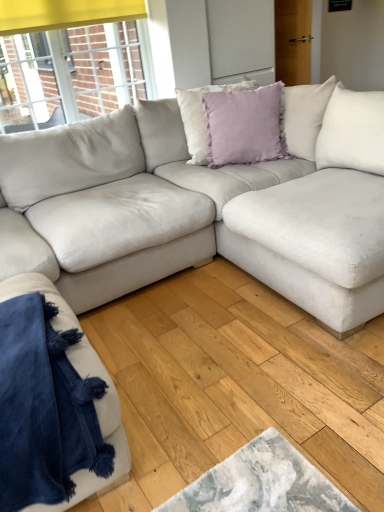
Question: Is lavender velvet pillow at center, marked as the second pillow in a front-to-back arrangement, bigger than velvet blue blanket at lower left?

Choices:
 (A) yes
 (B) no

Answer: (B)

Question: Can you confirm if lavender velvet pillow at center, the first pillow positioned from the back, is taller than velvet blue blanket at lower left?

Choices:
 (A) yes
 (B) no

Answer: (A)

Question: From the image's perspective, is lavender velvet pillow at center, the first pillow positioned from the back, under velvet blue blanket at lower left?

Choices:
 (A) no
 (B) yes

Answer: (A)

Question: Is the position of lavender velvet pillow at center, the first pillow positioned from the back, less distant than that of velvet blue blanket at lower left?

Choices:
 (A) no
 (B) yes

Answer: (A)

Question: Is lavender velvet pillow at center, the first pillow positioned from the back, smaller than velvet blue blanket at lower left?

Choices:
 (A) yes
 (B) no

Answer: (A)

Question: Relative to velvet blue blanket at lower left, is lavender velvet pillow at center, the first pillow positioned from the back, in front or behind?

Choices:
 (A) front
 (B) behind

Answer: (B)

Question: From a real-world perspective, is lavender velvet pillow at center, the first pillow positioned from the back, above or below velvet blue blanket at lower left?

Choices:
 (A) below
 (B) above

Answer: (B)

Question: Considering the positions of lavender velvet pillow at center, marked as the second pillow in a front-to-back arrangement, and velvet blue blanket at lower left in the image, is lavender velvet pillow at center, marked as the second pillow in a front-to-back arrangement, bigger or smaller than velvet blue blanket at lower left?

Choices:
 (A) big
 (B) small

Answer: (B)

Question: Which is correct: lavender velvet pillow at center, the first pillow positioned from the back, is inside velvet blue blanket at lower left, or outside of it?

Choices:
 (A) outside
 (B) inside

Answer: (A)

Question: From the image's perspective, is lavender velvet pillow at upper center, which is the 1th pillow from front to back, located above or below velvet blue blanket at lower left?

Choices:
 (A) below
 (B) above

Answer: (B)

Question: Visually, is lavender velvet pillow at upper center, which is the 1th pillow from front to back, positioned to the left or to the right of velvet blue blanket at lower left?

Choices:
 (A) right
 (B) left

Answer: (A)

Question: Relative to velvet blue blanket at lower left, is lavender velvet pillow at upper center, the 2th pillow when ordered from back to front, in front or behind?

Choices:
 (A) front
 (B) behind

Answer: (B)

Question: Is point (221, 159) closer or farther from the camera than point (110, 414)?

Choices:
 (A) farther
 (B) closer

Answer: (A)

Question: Choose the correct answer: Is lavender velvet pillow at upper center, the 2th pillow when ordered from back to front, inside lavender velvet pillow at center, marked as the second pillow in a front-to-back arrangement, or outside it?

Choices:
 (A) outside
 (B) inside

Answer: (A)

Question: Is lavender velvet pillow at upper center, which is the 1th pillow from front to back, taller or shorter than lavender velvet pillow at center, marked as the second pillow in a front-to-back arrangement?

Choices:
 (A) tall
 (B) short

Answer: (B)